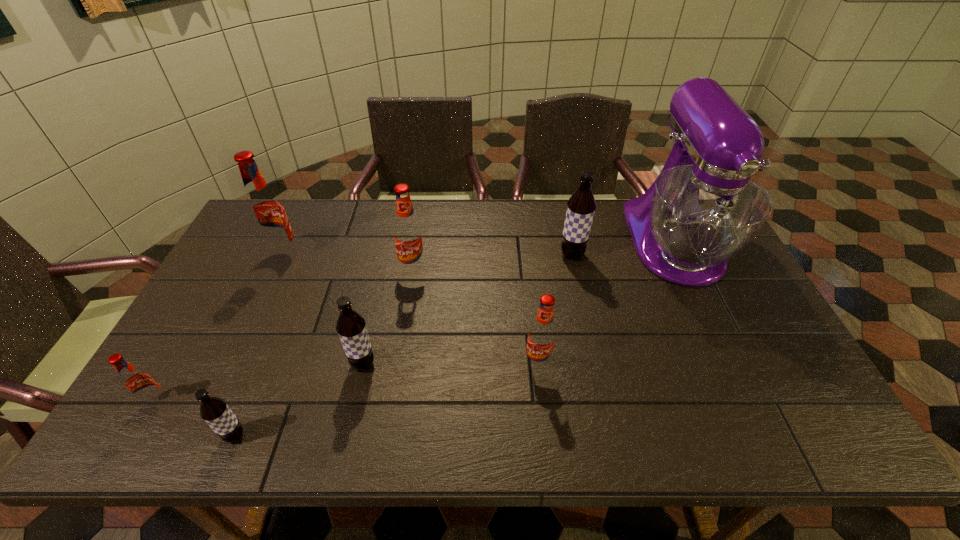
Identify the location of purple mixer. This screenshot has height=540, width=960. (703, 209).

Identify the location of mixer. (703, 209).

The height and width of the screenshot is (540, 960). I want to click on the seventh shortest object, so click(x=265, y=210).

What are the coordinates of `the second root beer from left to right` in the screenshot? It's located at (265, 210).

This screenshot has height=540, width=960. In order to click on the fourth object from right to left in this screenshot , I will do `click(408, 236)`.

Find the location of a particular element. the third root beer from right to left is located at coordinates (408, 236).

Identify the location of the seventh object from left to right. (581, 206).

You are a GUI agent. You are given a task and a screenshot of the screen. Output one action in this format:
    pyautogui.click(x=<x>, y=<y>)
    Task: Click on the rightmost root beer
    This screenshot has width=960, height=540.
    Given the screenshot: What is the action you would take?
    pyautogui.click(x=581, y=206)

This screenshot has width=960, height=540. I want to click on the rightmost red root beer, so click(542, 333).

The width and height of the screenshot is (960, 540). Find the location of `the third object from right to left`. the third object from right to left is located at coordinates (542, 333).